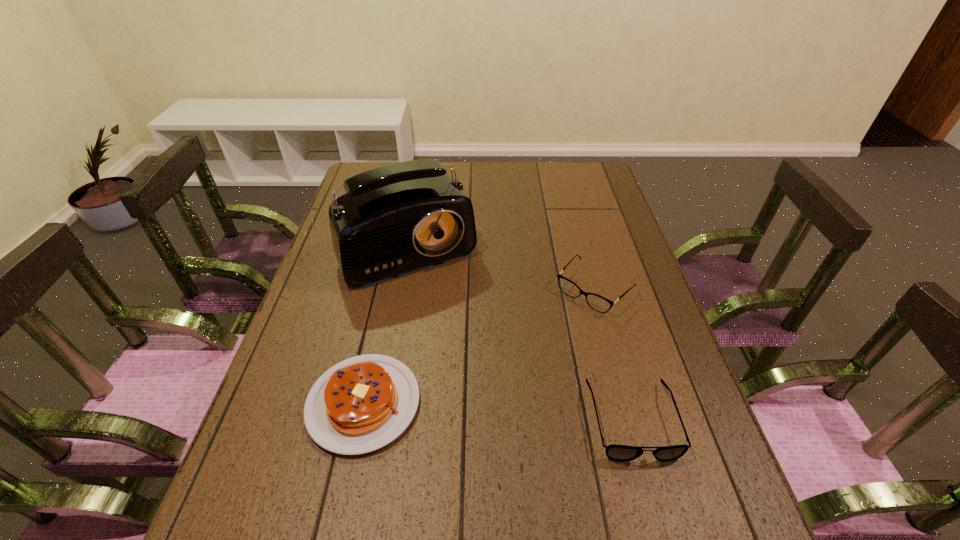
This screenshot has width=960, height=540. Find the location of `vacant space at the right edge of the desktop`. vacant space at the right edge of the desktop is located at coordinates (595, 199).

Identify the location of vacant space at the near right corner. The image size is (960, 540). (673, 489).

Where is `unoccupied position between the nearer spectacles and the farther spectacles`? Image resolution: width=960 pixels, height=540 pixels. unoccupied position between the nearer spectacles and the farther spectacles is located at coordinates (613, 355).

The image size is (960, 540). I want to click on vacant space that's between the nearer spectacles and the pancake, so click(498, 411).

Where is `vacant space in between the farther spectacles and the nearer spectacles`? The image size is (960, 540). vacant space in between the farther spectacles and the nearer spectacles is located at coordinates (613, 355).

In order to click on empty location between the pancake and the nearer spectacles in this screenshot , I will do `click(498, 411)`.

Find the location of a particular element. Image resolution: width=960 pixels, height=540 pixels. free point between the nearer spectacles and the tallest object is located at coordinates (522, 330).

The height and width of the screenshot is (540, 960). Identify the location of vacant space that's between the farther spectacles and the radio receiver. (503, 265).

Image resolution: width=960 pixels, height=540 pixels. I want to click on unoccupied position between the farther spectacles and the nearer spectacles, so click(613, 355).

Identify the location of vacant space in between the farther spectacles and the tallest object. (503, 265).